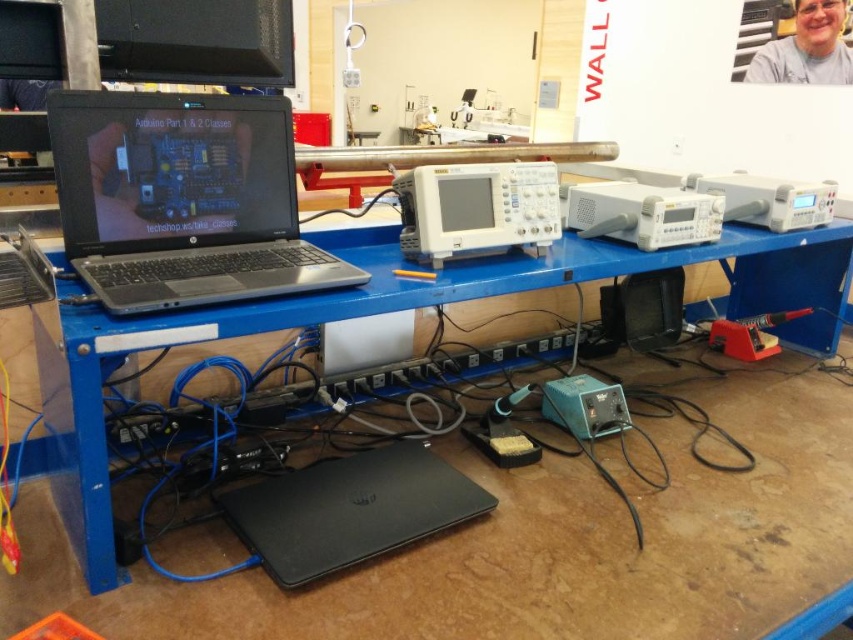
You are a technician standing in front of the workspace. You need to reach the white plastic oscilloscope at center to perform a test. Considering your arm length is 2.5 feet, can you comfortably reach it without moving your position?

The white plastic oscilloscope at center is 4.42 feet from the viewer. Since your arm length is 2.5 feet, you cannot comfortably reach it without moving your position as the distance exceeds your arm span.

You are standing in front of the workspace and want to reach both the point at coordinate (314, 515) and the point at coordinate (782, 58). Which point will you reach first?

You will reach the point at coordinate (314, 515) first because it is closer to you than the point at coordinate (782, 58).

You are setting up a presentation and need to place both the black matte laptop at lower center and the white plastic oscilloscope at center on a table. Which device should you place first to ensure there is enough space for both?

The black matte laptop at lower center is larger than the white plastic oscilloscope at center, so you should place the black matte laptop at lower center first to ensure there is enough space for both.